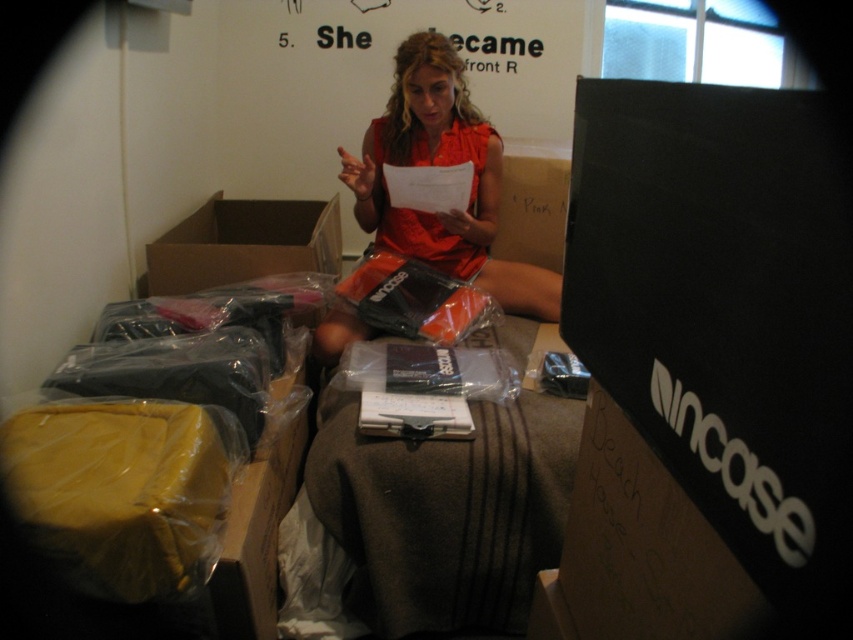
You are organizing a closet and need to place the orange matte dress at center and the brown cardboard box at upper left. According to the image, which object is positioned to the right of the other?

The orange matte dress at center is positioned to the right of the brown cardboard box at upper left.

You are helping organize a closet and need to decide whether the orange matte dress at center can fit into the brown cardboard box at upper left. Based on their sizes, can the dress fit inside the box?

The orange matte dress at center might be wider than brown cardboard box at upper left, so there is a possibility that it won not fit inside the box.

You are helping organize a storage room and need to place the orange matte dress at center and the brown cardboard box at upper left. Based on their positions in the image, which item is located higher up?

The orange matte dress at center is above the brown cardboard box at upper left, so it is located higher up.